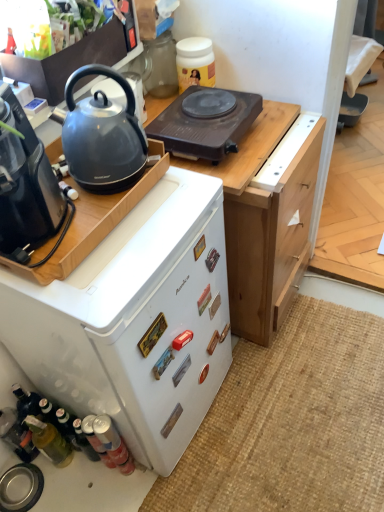
Image resolution: width=384 pixels, height=512 pixels. I want to click on vacant area located to the right-hand side of metallic silver sink at lower left, the 3th kitchen appliance in the top-to-bottom sequence, so click(72, 489).